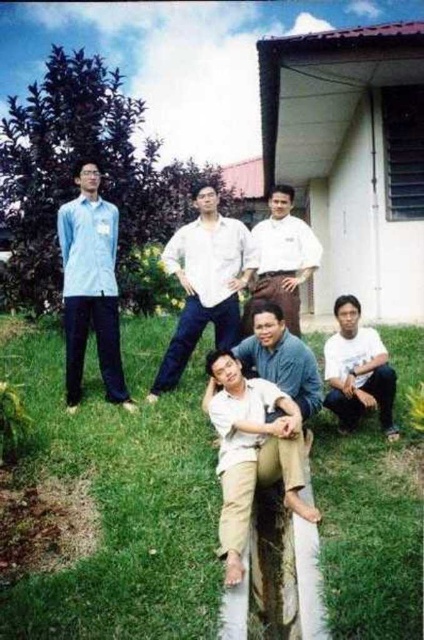
Question: Which point is closer to the camera?

Choices:
 (A) (86, 600)
 (B) (256, 316)
 (C) (270, 384)

Answer: (A)

Question: Does green grass at lower center come behind beige cotton pants at lower center?

Choices:
 (A) yes
 (B) no

Answer: (A)

Question: Does green grass at lower center appear under white cotton shirt at center?

Choices:
 (A) no
 (B) yes

Answer: (B)

Question: Which point is farther to the camera?

Choices:
 (A) white smooth shirt at center
 (B) matte blue shirt at left
 (C) white cotton shirt at center

Answer: (C)

Question: Is beige cotton pants at lower center above white cotton shirt at center?

Choices:
 (A) no
 (B) yes

Answer: (A)

Question: Which object appears farthest from the camera in this image?

Choices:
 (A) beige cotton pants at lower center
 (B) white smooth shirt at center

Answer: (B)